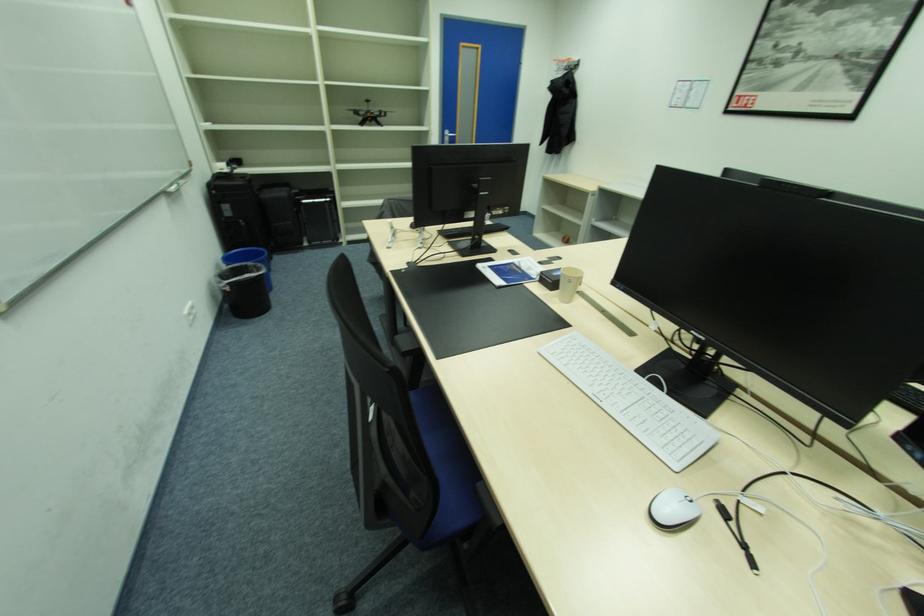
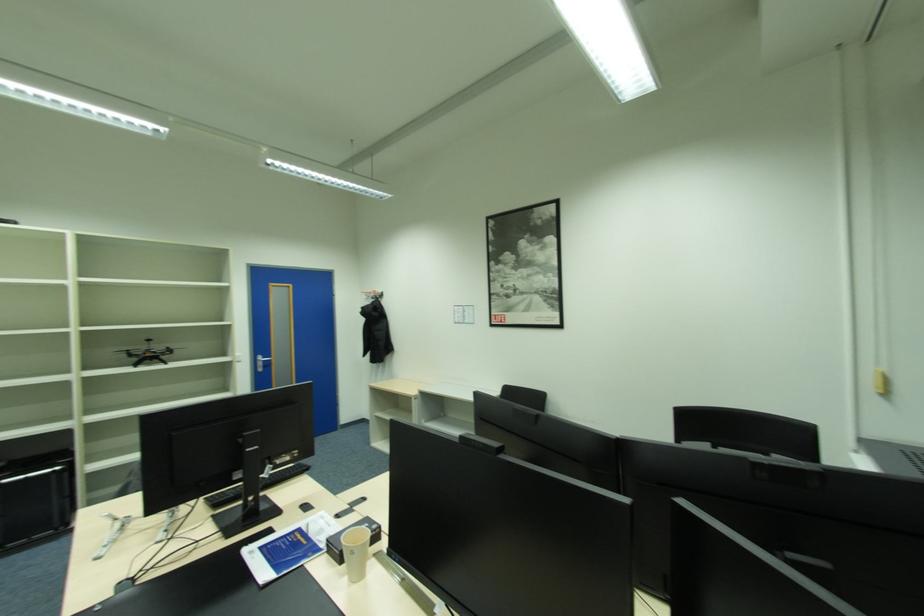
From the picture: The images are taken continuously from a first-person perspective. In which direction is your viewpoint rotating?

The camera's rotation is toward right-up.